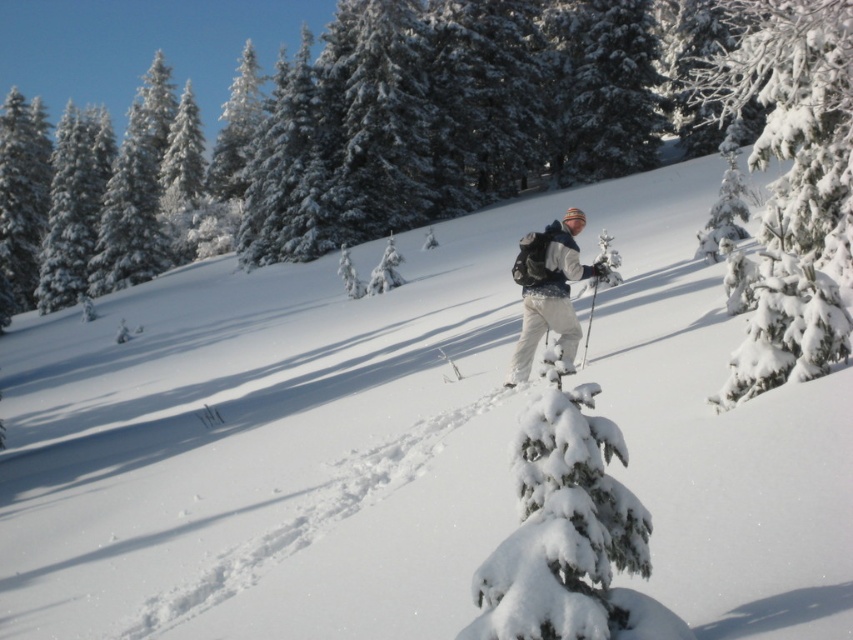
Based on the coordinates provided, what object is located at point (793, 186) in the winter scene?

The point (793, 186) corresponds to the white snow covered tree at center.